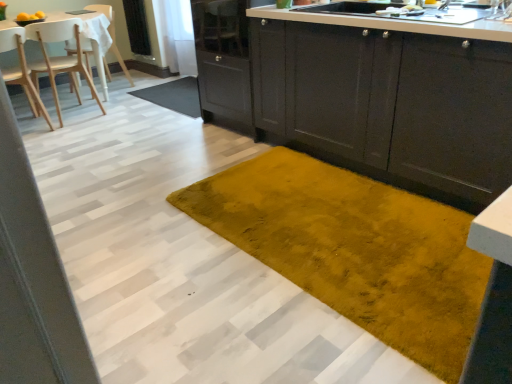
Question: Does mustard yellow plush rug at center, the 1th doormat in the top-to-bottom sequence, have a larger size compared to wooden chair at left, the 2th chair from the front?

Choices:
 (A) yes
 (B) no

Answer: (B)

Question: Does mustard yellow plush rug at center, the 1th doormat when ordered from back to front, have a smaller size compared to wooden chair at left, the 2th chair from the front?

Choices:
 (A) no
 (B) yes

Answer: (B)

Question: Is mustard yellow plush rug at center, which ranks as the 2th doormat in bottom-to-top order, at the left side of wooden chair at left, the 2th chair from the front?

Choices:
 (A) no
 (B) yes

Answer: (A)

Question: Are mustard yellow plush rug at center, the 1th doormat in the top-to-bottom sequence, and wooden chair at left, the 2th chair from the front, far apart?

Choices:
 (A) yes
 (B) no

Answer: (B)

Question: From the image's perspective, does mustard yellow plush rug at center, which ranks as the 2th doormat in bottom-to-top order, appear higher than wooden chair at left, placed as the 2th chair when sorted from back to front?

Choices:
 (A) yes
 (B) no

Answer: (B)

Question: Considering the positions of wooden chair at left, the 2th chair from the front, and velvet yellow rug at center, acting as the 1th doormat starting from the bottom, in the image, is wooden chair at left, the 2th chair from the front, taller or shorter than velvet yellow rug at center, acting as the 1th doormat starting from the bottom,?

Choices:
 (A) short
 (B) tall

Answer: (B)

Question: Is wooden chair at left, the 2th chair from the front, to the left or to the right of velvet yellow rug at center, marked as the second doormat in a back-to-front arrangement, in the image?

Choices:
 (A) right
 (B) left

Answer: (B)

Question: From the image's perspective, is wooden chair at left, placed as the 2th chair when sorted from back to front, positioned above or below velvet yellow rug at center, acting as the 1th doormat starting from the bottom?

Choices:
 (A) above
 (B) below

Answer: (A)

Question: In the image, is wooden chair at left, placed as the 2th chair when sorted from back to front, positioned in front of or behind velvet yellow rug at center, marked as the second doormat in a back-to-front arrangement?

Choices:
 (A) front
 (B) behind

Answer: (B)

Question: Would you say white wood chair at upper left, which is counted as the third chair, starting from the front, is inside or outside metallic silver faucet at upper right?

Choices:
 (A) outside
 (B) inside

Answer: (A)

Question: Considering the positions of white wood chair at upper left, the 1th chair viewed from the back, and metallic silver faucet at upper right in the image, is white wood chair at upper left, the 1th chair viewed from the back, wider or thinner than metallic silver faucet at upper right?

Choices:
 (A) thin
 (B) wide

Answer: (B)

Question: Considering the positions of white wood chair at upper left, which is counted as the third chair, starting from the front, and metallic silver faucet at upper right in the image, is white wood chair at upper left, which is counted as the third chair, starting from the front, taller or shorter than metallic silver faucet at upper right?

Choices:
 (A) short
 (B) tall

Answer: (B)

Question: From a real-world perspective, is white wood chair at upper left, which is counted as the third chair, starting from the front, positioned above or below metallic silver faucet at upper right?

Choices:
 (A) above
 (B) below

Answer: (B)

Question: Considering the positions of wooden chair at left, the 2th chair from the front, and white wood chair at upper left, the 1th chair viewed from the back, in the image, is wooden chair at left, the 2th chair from the front, wider or thinner than white wood chair at upper left, the 1th chair viewed from the back,?

Choices:
 (A) thin
 (B) wide

Answer: (B)

Question: Visually, is wooden chair at left, the 2th chair from the front, positioned to the left or to the right of white wood chair at upper left, the 1th chair viewed from the back?

Choices:
 (A) right
 (B) left

Answer: (B)